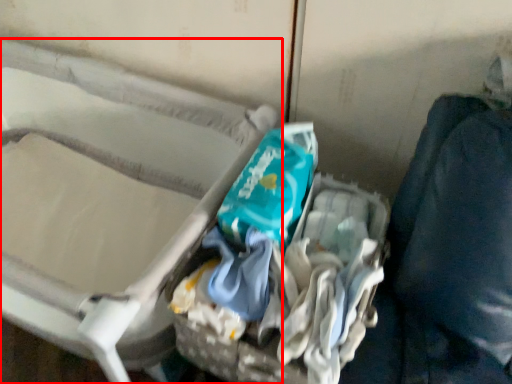
Question: From the image's perspective, where is furniture (annotated by the red box) located relative to garbage?

Choices:
 (A) above
 (B) below

Answer: (A)